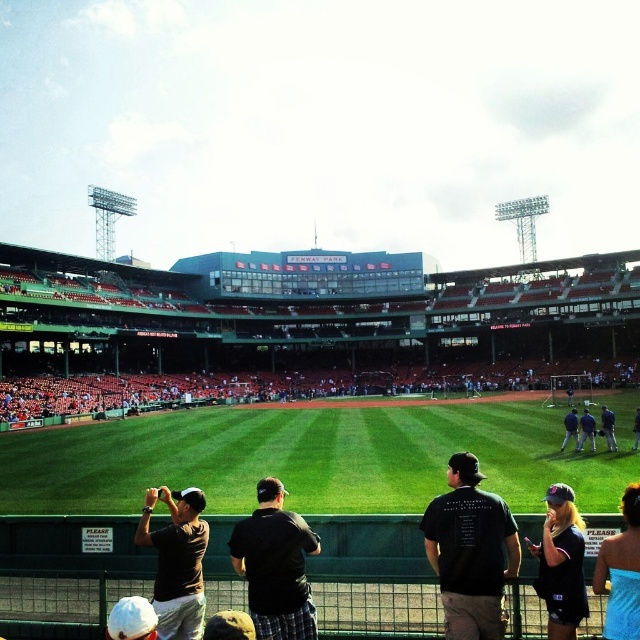
Question: Can you confirm if black matte shirt at center is wider than blue fabric shirt at lower right?

Choices:
 (A) no
 (B) yes

Answer: (B)

Question: Among these objects, which one is nearest to the camera?

Choices:
 (A) blue fabric shirt at lower right
 (B) black matte shirt at center
 (C) matte black baseball cap at lower right
 (D) dark blue jacket at right

Answer: (A)

Question: Which of the following is the closest to the observer?

Choices:
 (A) blue fabric shirt at lower right
 (B) dark blue shirt at center

Answer: (A)

Question: Is the position of black matte t-shirt at center more distant than that of matte black baseball cap at lower right?

Choices:
 (A) no
 (B) yes

Answer: (B)

Question: Which point is farther to the camera?

Choices:
 (A) dark blue shirt at center
 (B) matte black baseball cap at lower right
 (C) black matte shirt at center
 (D) matte black shirt at lower left

Answer: (A)

Question: Is black matte shirt at center behind matte black shirt at lower left?

Choices:
 (A) yes
 (B) no

Answer: (A)